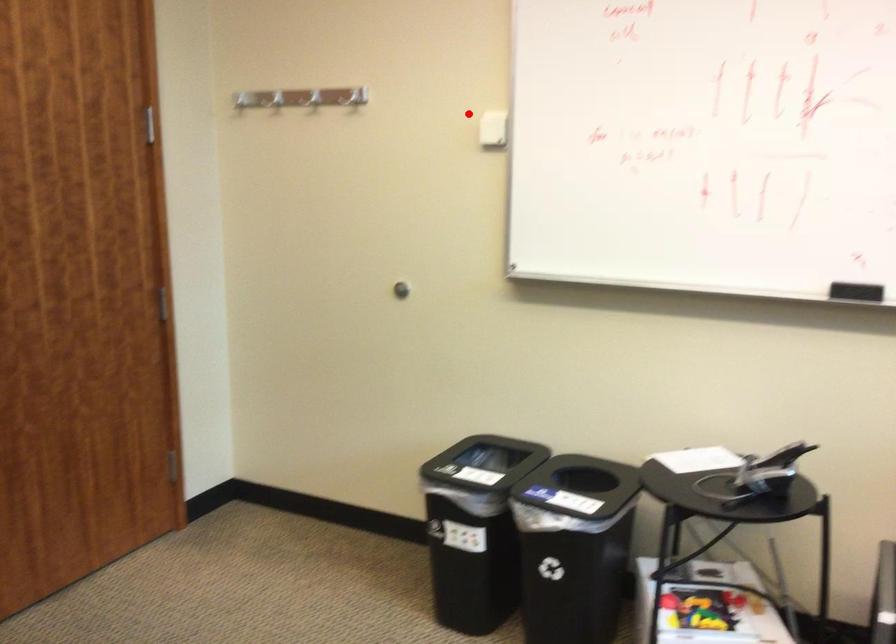
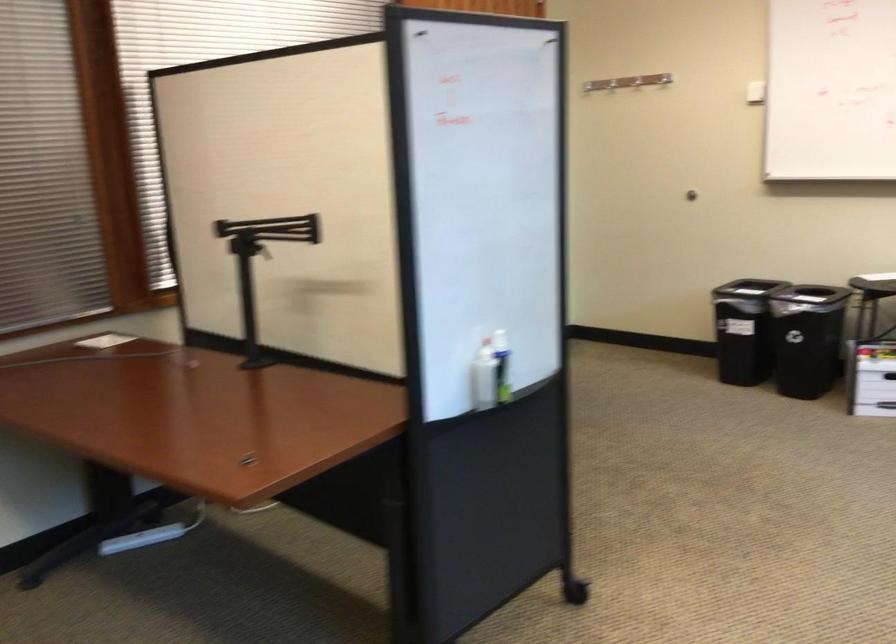
Question: A red point is marked in image1. In image2, is the corresponding 3D point closer to the camera or farther? Reply with the corresponding letter.

Choices:
 (A) The corresponding 3D point is closer.
 (B) The corresponding 3D point is farther.

Answer: (B)